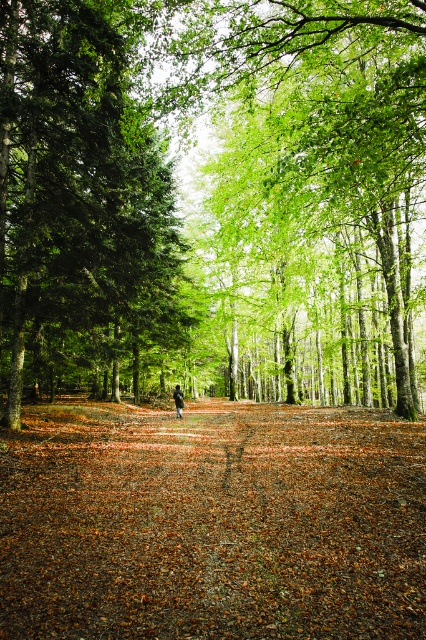
You are an ecologist studying the forest composition. You observe two types of trees at the center of the forest scene. Which one is bigger in size between the green leafy trees at center and the green matte tree at center?

The green leafy trees at center are larger in size than the green matte tree at center.

You are standing in the forest and want to take a photo of the green matte tree at center. If your camera has a maximum focus range of 10 meters, will you be able to capture it clearly?

The green matte tree at center is 10.66 meters away from viewer, which exceeds the camera maximum focus range of 10 meters. Therefore, you won

You are standing at the center of the forest and want to locate the green matte tree at center. According to the coordinates provided, where should you look relative to your position?

The green matte tree at center is located at coordinates point (78,198), so you should look slightly to the right and down from your central position to find it.